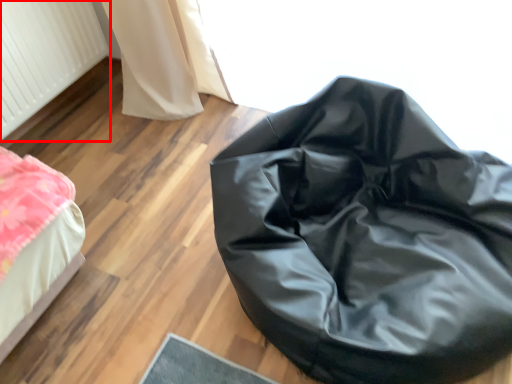
Question: From the image's perspective, what is the correct spatial positioning of radiator (annotated by the red box) in reference to furniture?

Choices:
 (A) below
 (B) above

Answer: (B)